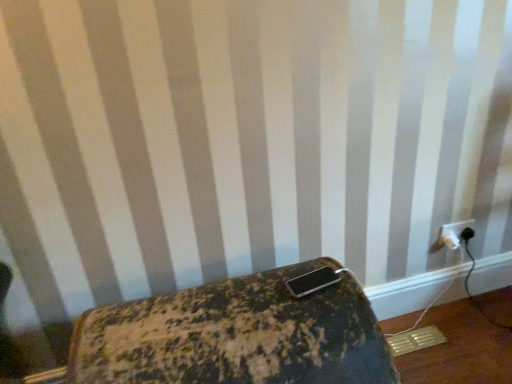
The image size is (512, 384). What are the coordinates of `rusty metal suitcase at lower center` in the screenshot? It's located at (237, 335).

Image resolution: width=512 pixels, height=384 pixels. Describe the element at coordinates (237, 335) in the screenshot. I see `rusty metal suitcase at lower center` at that location.

What do you see at coordinates (453, 233) in the screenshot? This screenshot has height=384, width=512. I see `white plastic power plugs and sockets at lower right` at bounding box center [453, 233].

You are a GUI agent. You are given a task and a screenshot of the screen. Output one action in this format:
    pyautogui.click(x=<x>, y=<y>)
    Task: Click on the white plastic power plugs and sockets at lower right
    The height and width of the screenshot is (384, 512).
    Given the screenshot: What is the action you would take?
    pyautogui.click(x=453, y=233)

Measure the distance between white plastic power plugs and sockets at lower right and camera.

white plastic power plugs and sockets at lower right is 5.56 feet from camera.

At what (x,y) coordinates should I click in order to perform the action: click on rusty metal suitcase at lower center. Please return your answer as a coordinate pair (x, y). The width and height of the screenshot is (512, 384). Looking at the image, I should click on (237, 335).

Considering the relative positions of white plastic power plugs and sockets at lower right and rusty metal suitcase at lower center in the image provided, is white plastic power plugs and sockets at lower right to the left or to the right of rusty metal suitcase at lower center?

Based on their positions, white plastic power plugs and sockets at lower right is located to the right of rusty metal suitcase at lower center.

Which object is closer to the camera taking this photo, white plastic power plugs and sockets at lower right or rusty metal suitcase at lower center?

rusty metal suitcase at lower center is closer to the camera.

Considering the positions of points (458, 244) and (337, 268), is point (458, 244) closer to camera compared to point (337, 268)?

No, it is not.

From the image's perspective, relative to rusty metal suitcase at lower center, is white plastic power plugs and sockets at lower right above or below?

white plastic power plugs and sockets at lower right is above rusty metal suitcase at lower center.

From a real-world perspective, is white plastic power plugs and sockets at lower right below rusty metal suitcase at lower center?

Actually, white plastic power plugs and sockets at lower right is physically above rusty metal suitcase at lower center in the real world.

Is white plastic power plugs and sockets at lower right wider or thinner than rusty metal suitcase at lower center?

In the image, white plastic power plugs and sockets at lower right appears to be more narrow than rusty metal suitcase at lower center.

Is white plastic power plugs and sockets at lower right shorter than rusty metal suitcase at lower center?

Correct, white plastic power plugs and sockets at lower right is not as tall as rusty metal suitcase at lower center.

Between white plastic power plugs and sockets at lower right and rusty metal suitcase at lower center, which one has smaller size?

With smaller size is white plastic power plugs and sockets at lower right.

Would you say white plastic power plugs and sockets at lower right is outside rusty metal suitcase at lower center?

white plastic power plugs and sockets at lower right lies outside rusty metal suitcase at lower center's area.

Is there a large distance between white plastic power plugs and sockets at lower right and rusty metal suitcase at lower center?

→ Indeed, white plastic power plugs and sockets at lower right is not near rusty metal suitcase at lower center.

Is white plastic power plugs and sockets at lower right facing towards rusty metal suitcase at lower center?

No, white plastic power plugs and sockets at lower right does not turn towards rusty metal suitcase at lower center.

How different are the orientations of white plastic power plugs and sockets at lower right and rusty metal suitcase at lower center in degrees?

1.05 degrees separate the facing orientations of white plastic power plugs and sockets at lower right and rusty metal suitcase at lower center.

In the scene shown: How much distance is there between white plastic power plugs and sockets at lower right and rusty metal suitcase at lower center?

white plastic power plugs and sockets at lower right and rusty metal suitcase at lower center are 1.01 meters apart from each other.

At what (x,y) coordinates should I click in order to perform the action: click on power plugs and sockets located above the rusty metal suitcase at lower center (from the image's perspective). Please return your answer as a coordinate pair (x, y). Image resolution: width=512 pixels, height=384 pixels. Looking at the image, I should click on (453, 233).

Which object is positioned more to the left, rusty metal suitcase at lower center or white plastic power plugs and sockets at lower right?

From the viewer's perspective, rusty metal suitcase at lower center appears more on the left side.

Is rusty metal suitcase at lower center in front of white plastic power plugs and sockets at lower right?

Yes, rusty metal suitcase at lower center is closer to the viewer.

Considering the positions of points (367, 300) and (455, 241), is point (367, 300) closer to camera compared to point (455, 241)?

That is True.

From the image's perspective, who appears lower, rusty metal suitcase at lower center or white plastic power plugs and sockets at lower right?

rusty metal suitcase at lower center.

From a real-world perspective, does rusty metal suitcase at lower center stand above white plastic power plugs and sockets at lower right?

Actually, rusty metal suitcase at lower center is physically below white plastic power plugs and sockets at lower right in the real world.

Does rusty metal suitcase at lower center have a lesser width compared to white plastic power plugs and sockets at lower right?

In fact, rusty metal suitcase at lower center might be wider than white plastic power plugs and sockets at lower right.

Which of these two, rusty metal suitcase at lower center or white plastic power plugs and sockets at lower right, stands shorter?

white plastic power plugs and sockets at lower right is shorter.

Does rusty metal suitcase at lower center have a larger size compared to white plastic power plugs and sockets at lower right?

Yes.

Is rusty metal suitcase at lower center situated inside white plastic power plugs and sockets at lower right or outside?

rusty metal suitcase at lower center is located beyond the bounds of white plastic power plugs and sockets at lower right.

Is rusty metal suitcase at lower center positioned far away from white plastic power plugs and sockets at lower right?

Yes, rusty metal suitcase at lower center is far from white plastic power plugs and sockets at lower right.

Is rusty metal suitcase at lower center facing towards white plastic power plugs and sockets at lower right?

No, rusty metal suitcase at lower center is not oriented towards white plastic power plugs and sockets at lower right.

How many degrees apart are the facing directions of rusty metal suitcase at lower center and white plastic power plugs and sockets at lower right?

rusty metal suitcase at lower center and white plastic power plugs and sockets at lower right are facing 1.05 degrees away from each other.

The width and height of the screenshot is (512, 384). I want to click on furniture that is under the white plastic power plugs and sockets at lower right (from a real-world perspective), so 237,335.

Locate an element on the screen. The height and width of the screenshot is (384, 512). furniture located in front of the white plastic power plugs and sockets at lower right is located at coordinates (237, 335).

Where is `furniture lying on the left of white plastic power plugs and sockets at lower right`? furniture lying on the left of white plastic power plugs and sockets at lower right is located at coordinates (237, 335).